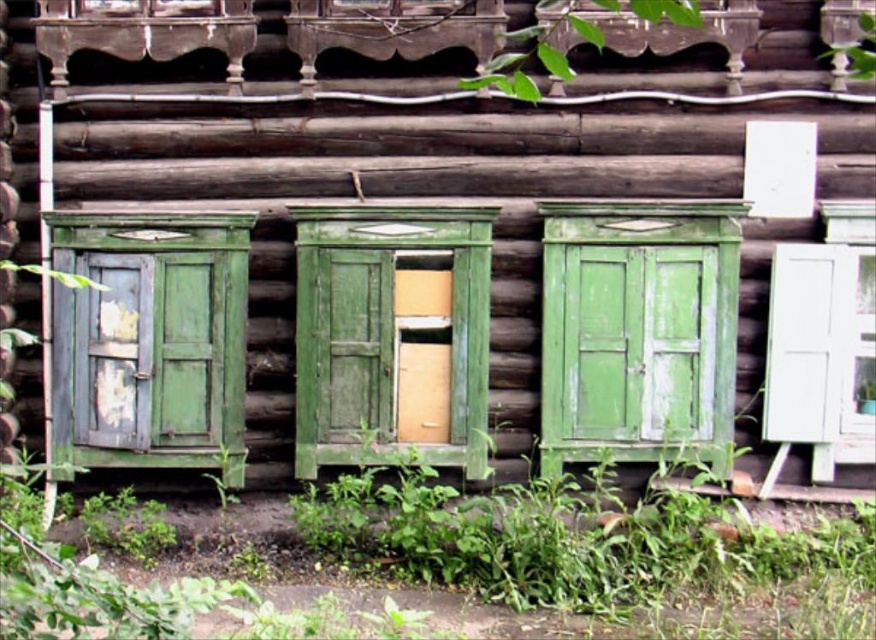
You are a painter planning to repaint the green matte cabinet at center and the green wood cabinet at center. Since you want to paint the taller one first, which cabinet should you start with?

The green matte cabinet at center is much taller as green wood cabinet at center, so you should start painting the green matte cabinet at center first.

You are standing in front of the rustic wooden structure and want to place a small potted plant between the green matte cabinet at center and the green leafy plant at upper center. Based on their positions, which object should the potted plant be closer to?

The potted plant should be closer to the green leafy plant at upper center because the green matte cabinet at center is to the right of it, meaning the cabinet is further to the right side compared to the plant.

You are standing in front of the rustic wooden cabin with the green cabinets. There are two points marked on the image. Which point is closer to you, point (689,428) or point (630,10)?

Point (630,10) is closer to you because it is less further to the viewer than point (689,428).